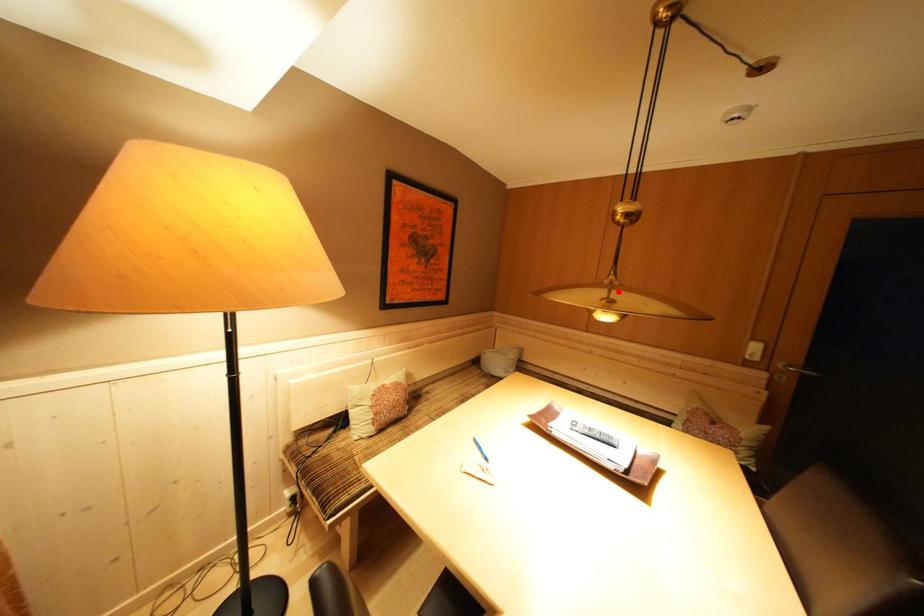
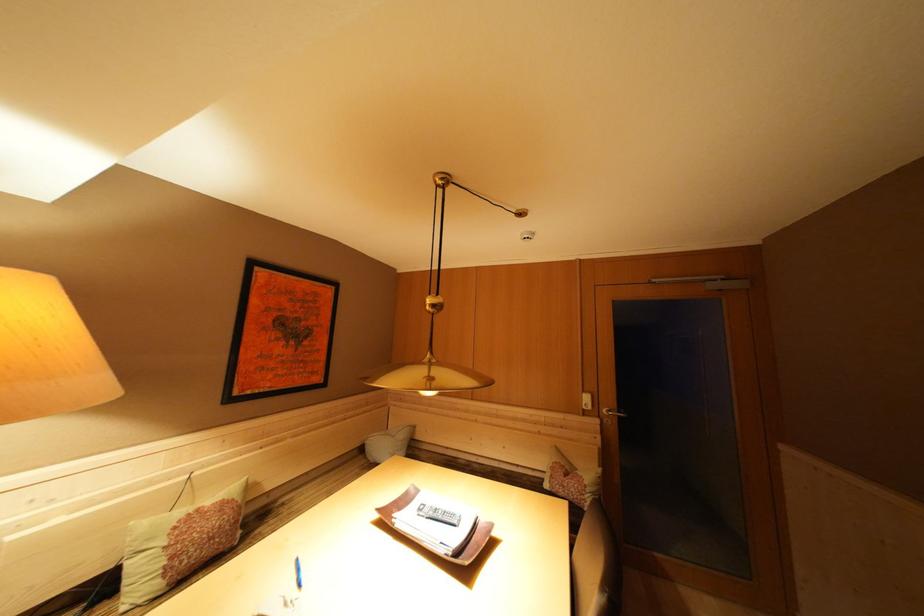
The point at the highlighted location is marked in the first image. Where is the corresponding point in the second image?

(438, 369)